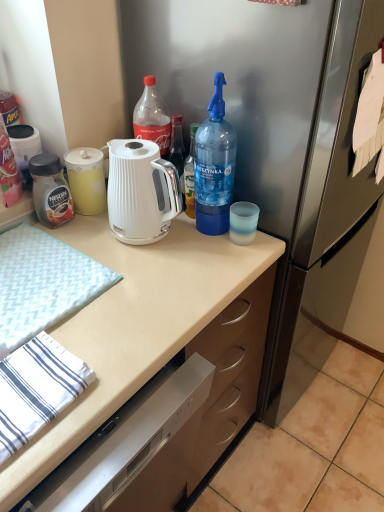
This screenshot has height=512, width=384. In order to click on blank area to the left of white glossy electric kettle at center in this screenshot , I will do `click(93, 237)`.